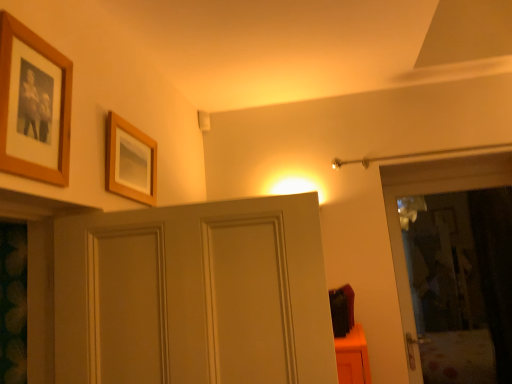
Question: Which direction should I rotate to face wooden picture frame at upper center, marked as the 2th picture frame in a front-to-back arrangement, — up or down?

Choices:
 (A) down
 (B) up

Answer: (B)

Question: Can you confirm if wooden photo frame at upper left, placed as the 1th picture frame when sorted from left to right, is positioned to the left of wooden picture frame at upper center, marked as the 2th picture frame in a front-to-back arrangement?

Choices:
 (A) no
 (B) yes

Answer: (B)

Question: Can you confirm if wooden photo frame at upper left, arranged as the 1th picture frame when viewed from the front, is wider than wooden picture frame at upper center, the first picture frame in the back-to-front sequence?

Choices:
 (A) no
 (B) yes

Answer: (A)

Question: Is wooden photo frame at upper left, placed as the 1th picture frame when sorted from left to right, taller than wooden picture frame at upper center, the first picture frame in the back-to-front sequence?

Choices:
 (A) no
 (B) yes

Answer: (B)

Question: From a real-world perspective, is wooden photo frame at upper left, acting as the second picture frame starting from the back, over wooden picture frame at upper center, arranged as the 1th picture frame when viewed from the right?

Choices:
 (A) yes
 (B) no

Answer: (A)

Question: Would you say wooden photo frame at upper left, placed as the 2th picture frame when sorted from right to left, contains wooden picture frame at upper center, arranged as the 1th picture frame when viewed from the right?

Choices:
 (A) no
 (B) yes

Answer: (A)

Question: Does wooden photo frame at upper left, arranged as the 1th picture frame when viewed from the front, come behind wooden picture frame at upper center, marked as the 2th picture frame in a front-to-back arrangement?

Choices:
 (A) no
 (B) yes

Answer: (A)

Question: Could you tell me if wooden picture frame at upper center, marked as the 2th picture frame in a front-to-back arrangement, is facing wooden photo frame at upper left, placed as the 2th picture frame when sorted from right to left?

Choices:
 (A) yes
 (B) no

Answer: (B)

Question: Is wooden picture frame at upper center, arranged as the 1th picture frame when viewed from the right, at the left side of wooden photo frame at upper left, arranged as the 1th picture frame when viewed from the front?

Choices:
 (A) yes
 (B) no

Answer: (B)

Question: Can wooden photo frame at upper left, placed as the 1th picture frame when sorted from left to right, be found inside wooden picture frame at upper center, marked as the 2th picture frame in a front-to-back arrangement?

Choices:
 (A) yes
 (B) no

Answer: (B)

Question: Considering the relative positions of wooden picture frame at upper center, which is the second picture frame in left-to-right order, and wooden photo frame at upper left, acting as the second picture frame starting from the back, in the image provided, is wooden picture frame at upper center, which is the second picture frame in left-to-right order, in front of wooden photo frame at upper left, acting as the second picture frame starting from the back,?

Choices:
 (A) yes
 (B) no

Answer: (B)

Question: Can you confirm if wooden picture frame at upper center, the first picture frame in the back-to-front sequence, is thinner than wooden photo frame at upper left, acting as the second picture frame starting from the back?

Choices:
 (A) yes
 (B) no

Answer: (B)

Question: From the image's perspective, does wooden picture frame at upper center, marked as the 2th picture frame in a front-to-back arrangement, appear higher than wooden photo frame at upper left, placed as the 1th picture frame when sorted from left to right?

Choices:
 (A) yes
 (B) no

Answer: (B)

Question: Visually, is wooden photo frame at upper left, arranged as the 1th picture frame when viewed from the front, positioned to the left or to the right of wooden picture frame at upper center, arranged as the 1th picture frame when viewed from the right?

Choices:
 (A) right
 (B) left

Answer: (B)